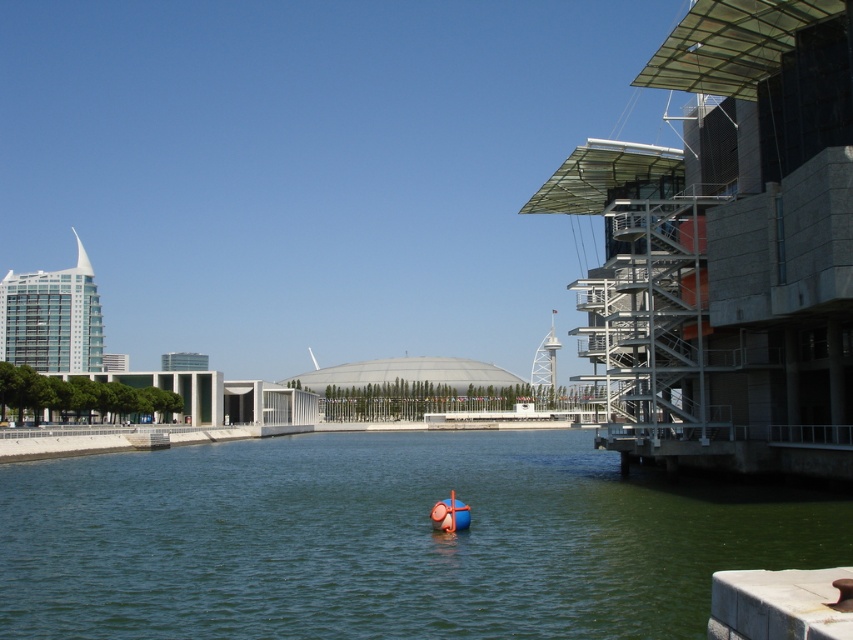
Is green water at center below orange rubber boat at center?

Indeed, green water at center is positioned under orange rubber boat at center.

Locate an element on the screen. This screenshot has width=853, height=640. green water at center is located at coordinates (387, 540).